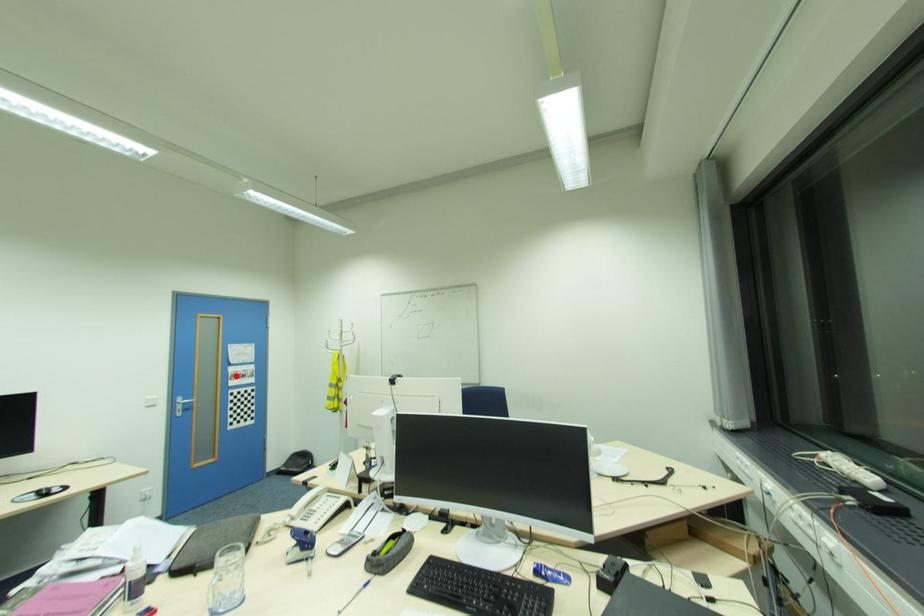
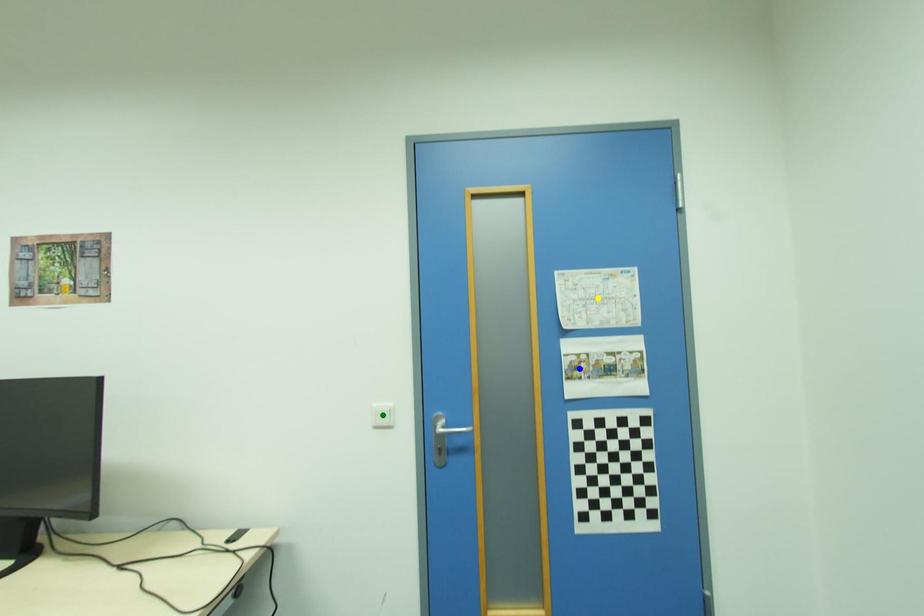
Question: I am providing you with two images of the same scene from different viewpoints. A red point is marked on the first image. You are given multiple points on the second image. Which point in image 2 is actually the same real-world point as the red point in image 1?

Choices:
 (A) blue point
 (B) green point
 (C) yellow point

Answer: (A)